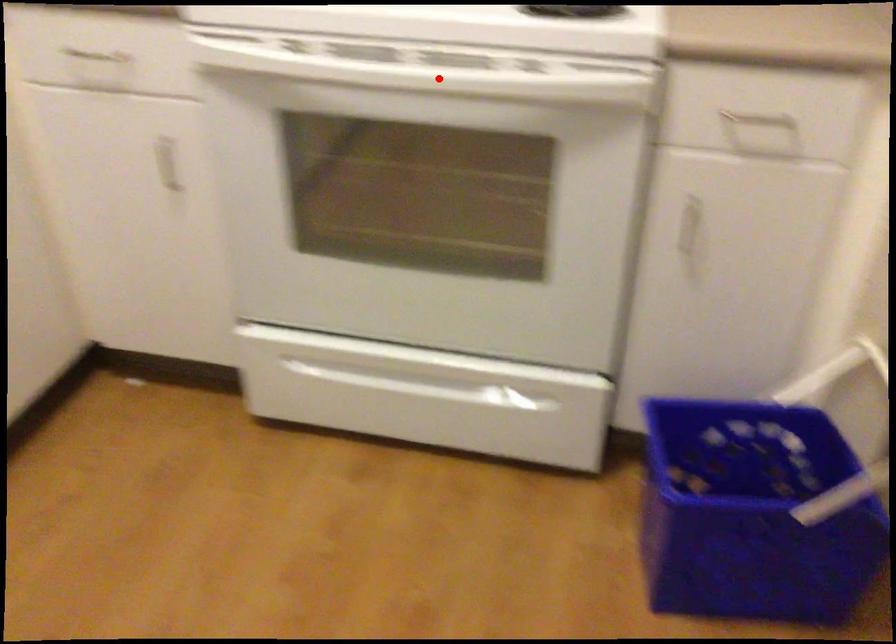
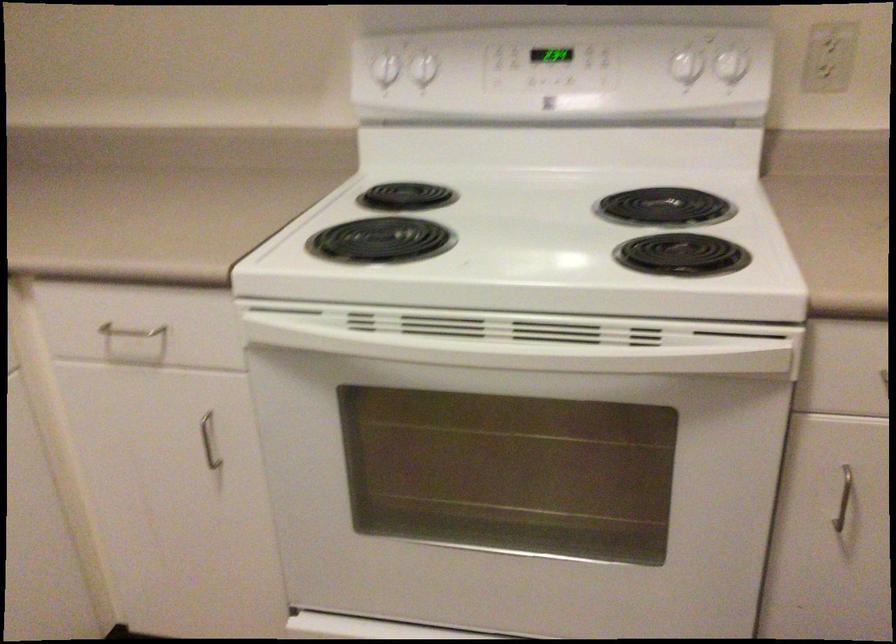
In the second image, find the point that corresponds to the highlighted location in the first image.

(526, 339)